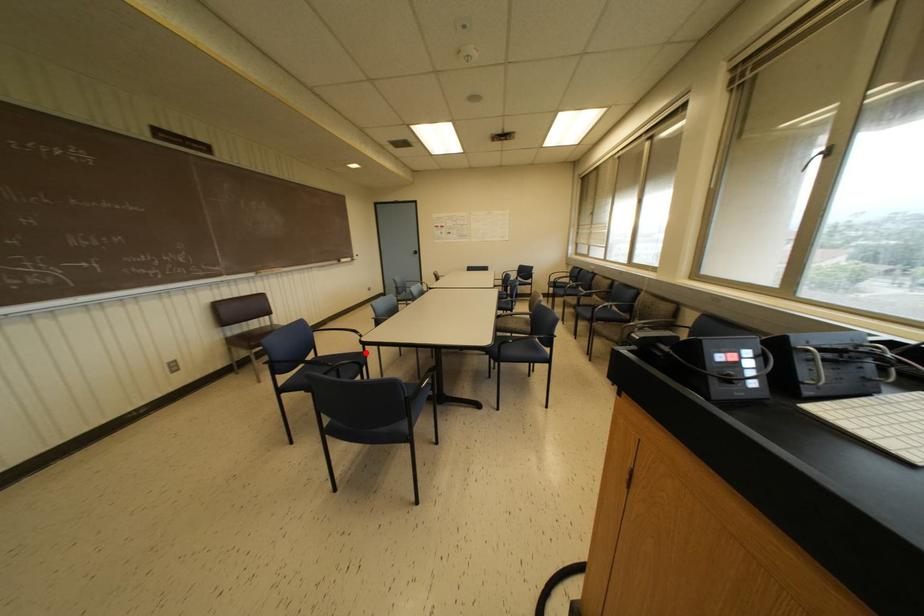
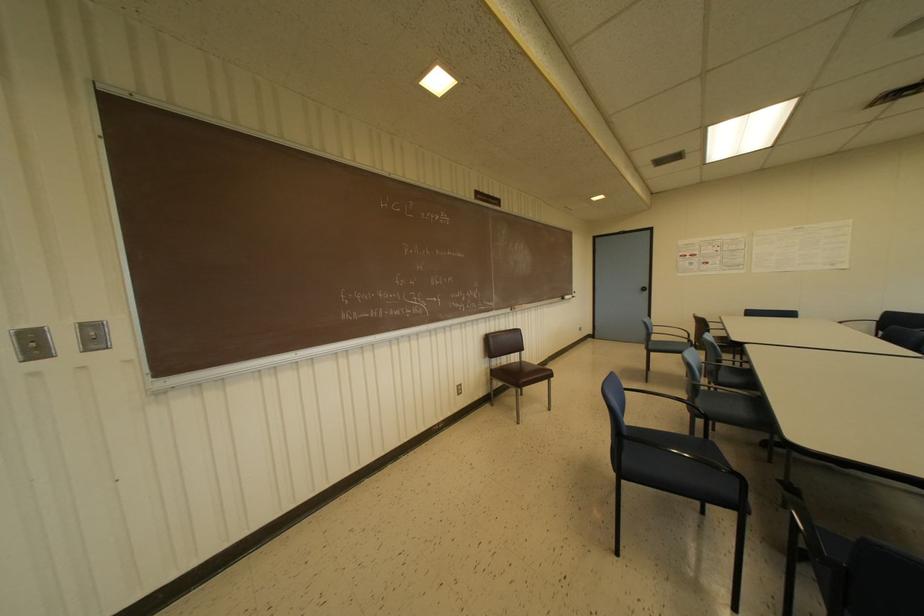
Locate, in the second image, the point that corresponds to the highlighted location in the first image.

(713, 443)